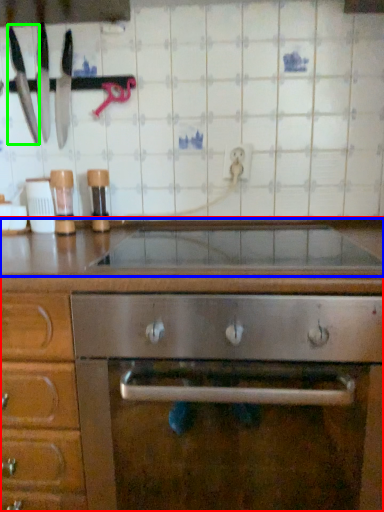
Question: Based on their relative distances, which object is nearer to cabinetry (highlighted by a red box)? Choose from countertop (highlighted by a blue box) and kitchen appliance (highlighted by a green box).

Choices:
 (A) countertop
 (B) kitchen appliance

Answer: (A)